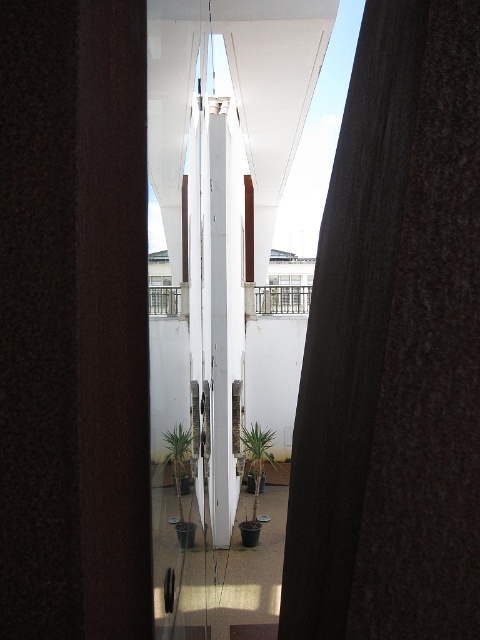
Is green leafy plant at center in front of white metal railing at center?

That is False.

Find the location of a particular element. This screenshot has height=640, width=480. green leafy plant at center is located at coordinates (256, 464).

Is green leafy plant at center to the left of metallic railing at center from the viewer's perspective?

Yes, green leafy plant at center is to the left of metallic railing at center.

Does green leafy plant at center have a greater width compared to metallic railing at center?

No, green leafy plant at center is not wider than metallic railing at center.

The image size is (480, 640). In order to click on green leafy plant at center in this screenshot , I will do `click(256, 464)`.

Is point (160, 627) more distant than point (274, 291)?

No, (160, 627) is in front of (274, 291).

What are the coordinates of `green matte potted plants at center` in the screenshot? It's located at (216, 566).

Find the location of a particular element. This screenshot has height=640, width=480. green matte potted plants at center is located at coordinates (216, 566).